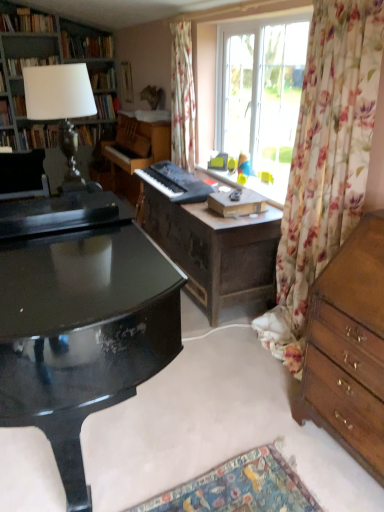
Question: From the image's perspective, does white fabric lampshade at upper left appear higher than matte black lampshade at upper left, marked as the 4th book in a top-to-bottom arrangement?

Choices:
 (A) yes
 (B) no

Answer: (B)

Question: Is the position of white fabric lampshade at upper left more distant than that of matte black lampshade at upper left, which is the fourth book from bottom to top?

Choices:
 (A) yes
 (B) no

Answer: (B)

Question: Can you confirm if white fabric lampshade at upper left is thinner than matte black lampshade at upper left, which is the fourth book from bottom to top?

Choices:
 (A) no
 (B) yes

Answer: (A)

Question: Can you confirm if white fabric lampshade at upper left is smaller than matte black lampshade at upper left, marked as the 4th book in a top-to-bottom arrangement?

Choices:
 (A) no
 (B) yes

Answer: (A)

Question: Is white fabric lampshade at upper left oriented away from matte black lampshade at upper left, marked as the 4th book in a top-to-bottom arrangement?

Choices:
 (A) no
 (B) yes

Answer: (A)

Question: Is hardcover book at left, the 7th book when ordered from top to bottom, bigger or smaller than hardcover books at upper left, which is the sixth book from bottom to top?

Choices:
 (A) big
 (B) small

Answer: (B)

Question: From the image's perspective, is hardcover book at left, the 1th book in the bottom-to-top sequence, located above or below hardcover books at upper left, the 2th book in the top-to-bottom sequence?

Choices:
 (A) below
 (B) above

Answer: (A)

Question: Considering the positions of hardcover book at left, the 7th book when ordered from top to bottom, and hardcover books at upper left, the 2th book in the top-to-bottom sequence, in the image, is hardcover book at left, the 7th book when ordered from top to bottom, wider or thinner than hardcover books at upper left, the 2th book in the top-to-bottom sequence,?

Choices:
 (A) wide
 (B) thin

Answer: (B)

Question: Is point (9, 136) positioned closer to the camera than point (94, 50)?

Choices:
 (A) closer
 (B) farther

Answer: (A)

Question: Considering the positions of wooden chest of drawers at right and hardcover book at left, the 2th book ordered from the bottom, in the image, is wooden chest of drawers at right wider or thinner than hardcover book at left, the 2th book ordered from the bottom,?

Choices:
 (A) thin
 (B) wide

Answer: (B)

Question: From the image's perspective, is wooden chest of drawers at right positioned above or below hardcover book at left, acting as the 6th book starting from the top?

Choices:
 (A) above
 (B) below

Answer: (B)

Question: From a real-world perspective, relative to hardcover book at left, acting as the 6th book starting from the top, is wooden chest of drawers at right vertically above or below?

Choices:
 (A) above
 (B) below

Answer: (B)

Question: Is point pyautogui.click(x=357, y=270) positioned closer to the camera than point pyautogui.click(x=38, y=138)?

Choices:
 (A) farther
 (B) closer

Answer: (B)

Question: From the image's perspective, relative to wooden piano at center, the second piano from the front, is hardcover book at upper center, acting as the 3th book starting from the bottom, above or below?

Choices:
 (A) below
 (B) above

Answer: (B)

Question: In terms of size, does hardcover book at upper center, acting as the 3th book starting from the bottom, appear bigger or smaller than wooden piano at center, the second piano from the front?

Choices:
 (A) big
 (B) small

Answer: (B)